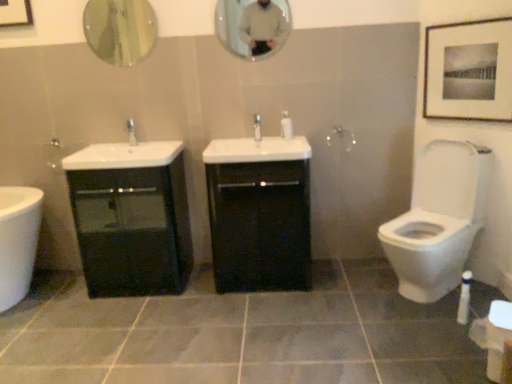
You are a GUI agent. You are given a task and a screenshot of the screen. Output one action in this format:
    pyautogui.click(x=<x>, y=<y>)
    Task: Click on the vacant space to the right of white plastic toothbrush at lower right
    
    Given the screenshot: What is the action you would take?
    pyautogui.click(x=476, y=309)